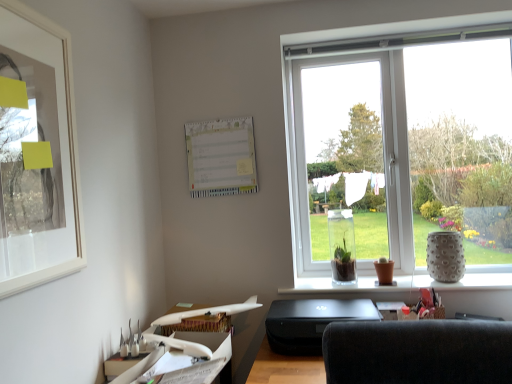
Where is `free space above clear glass vase at center (from a real-world perspective)`? free space above clear glass vase at center (from a real-world perspective) is located at coordinates (381, 280).